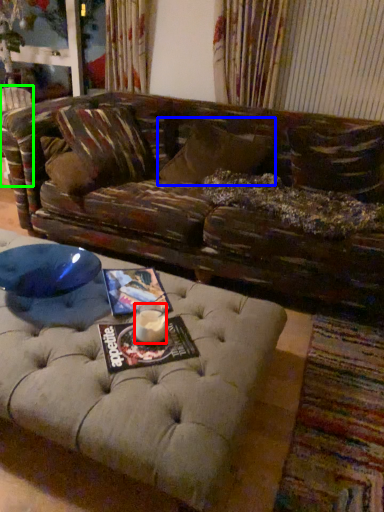
Question: Which object is positioned closest to beverage (highlighted by a red box)? Select from pillow (highlighted by a blue box) and swivel chair (highlighted by a green box).

Choices:
 (A) pillow
 (B) swivel chair

Answer: (A)